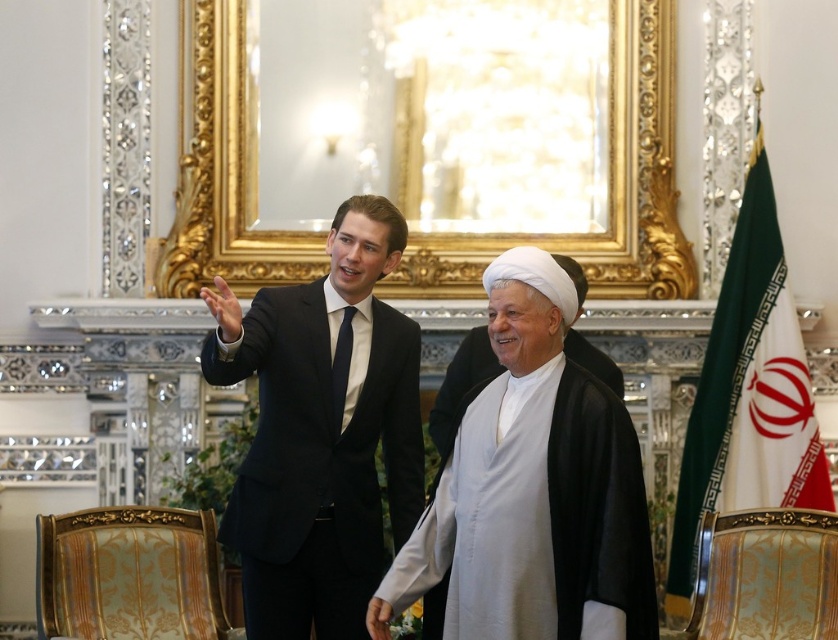
Question: Where is matte black suit at center located in relation to white matte robe at center in the image?

Choices:
 (A) right
 (B) left

Answer: (B)

Question: Does matte black suit at center appear under white matte robe at center?

Choices:
 (A) no
 (B) yes

Answer: (A)

Question: Is the position of matte black suit at center more distant than that of white matte robe at center?

Choices:
 (A) yes
 (B) no

Answer: (B)

Question: Which point is closer to the camera taking this photo?

Choices:
 (A) (484, 609)
 (B) (334, 536)

Answer: (A)